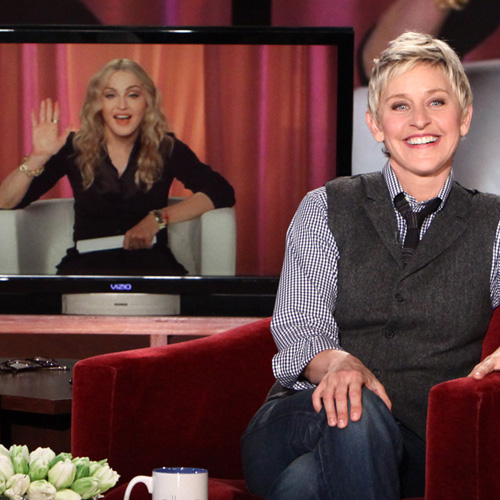
You are a GUI agent. You are given a task and a screenshot of the screen. Output one action in this format:
    pyautogui.click(x=<x>, y=<y>)
    Task: Click on the red velvet chair
    The height and width of the screenshot is (500, 500).
    Given the screenshot: What is the action you would take?
    pyautogui.click(x=183, y=416)